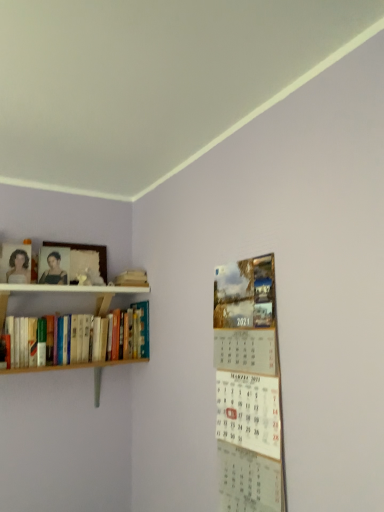
Question: Considering the positions of metallic silver calendar at right and wooden books at left in the image, is metallic silver calendar at right wider or thinner than wooden books at left?

Choices:
 (A) wide
 (B) thin

Answer: (B)

Question: In terms of height, does metallic silver calendar at right look taller or shorter compared to wooden books at left?

Choices:
 (A) tall
 (B) short

Answer: (A)

Question: Estimate the real-world distances between objects in this image. Which object is closer to the wooden books at left?

Choices:
 (A) matte white portrait at left, the 1th person when ordered from left to right
 (B) matte black portrait at upper left, which is counted as the first person, starting from the right
 (C) metallic silver calendar at right
 (D) wooden photo frame at upper left

Answer: (B)

Question: Which is nearer to the matte white portrait at left, acting as the 2th person starting from the right?

Choices:
 (A) wooden books at left
 (B) metallic silver calendar at right
 (C) matte black portrait at upper left, which is counted as the first person, starting from the right
 (D) wooden photo frame at upper left

Answer: (C)